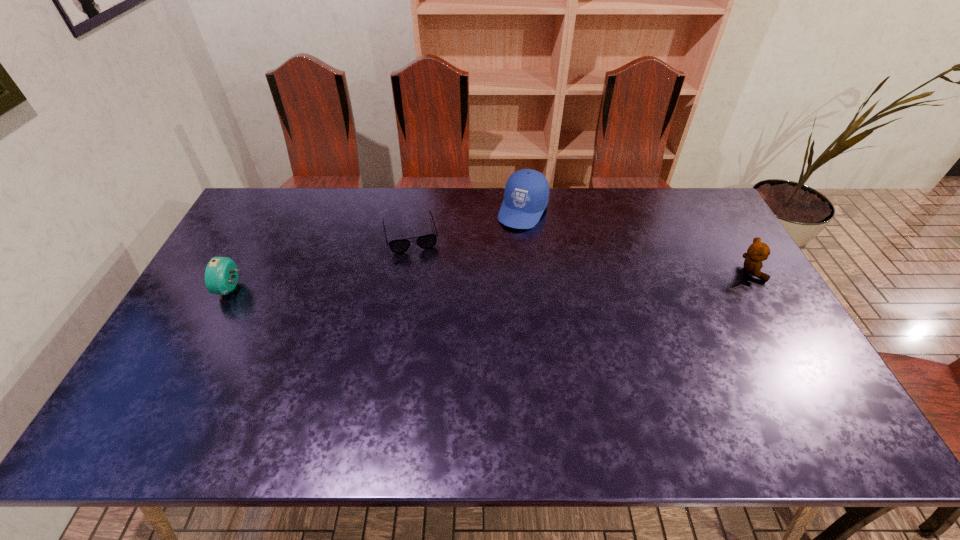
At what (x,y) coordinates should I click in order to perform the action: click on free space at the far right corner of the desktop. Please return your answer as a coordinate pair (x, y). Looking at the image, I should click on (693, 207).

Find the location of a particular element. The height and width of the screenshot is (540, 960). vacant area that lies between the alarm clock and the second object from left to right is located at coordinates (322, 261).

At what (x,y) coordinates should I click in order to perform the action: click on unoccupied area between the rightmost object and the second object from right to left. Please return your answer as a coordinate pair (x, y). The image size is (960, 540). Looking at the image, I should click on (636, 241).

I want to click on free spot between the rightmost object and the shortest object, so click(580, 252).

This screenshot has width=960, height=540. I want to click on free space between the teddy bear and the cap, so click(636, 241).

Find the location of `free space between the shortest object and the rightmost object`. free space between the shortest object and the rightmost object is located at coordinates point(580,252).

You are a GUI agent. You are given a task and a screenshot of the screen. Output one action in this format:
    pyautogui.click(x=<x>, y=<y>)
    Task: Click on the free space between the leftmost object and the teddy bear
    This screenshot has height=540, width=960.
    Given the screenshot: What is the action you would take?
    pyautogui.click(x=492, y=280)

Locate an element on the screen. Image resolution: width=960 pixels, height=540 pixels. free spot between the second object from right to left and the rightmost object is located at coordinates (636, 241).

Where is `vacant point located between the leftmost object and the teddy bear`? The image size is (960, 540). vacant point located between the leftmost object and the teddy bear is located at coordinates (492, 280).

This screenshot has width=960, height=540. Identify the location of empty location between the cap and the shortest object. (467, 222).